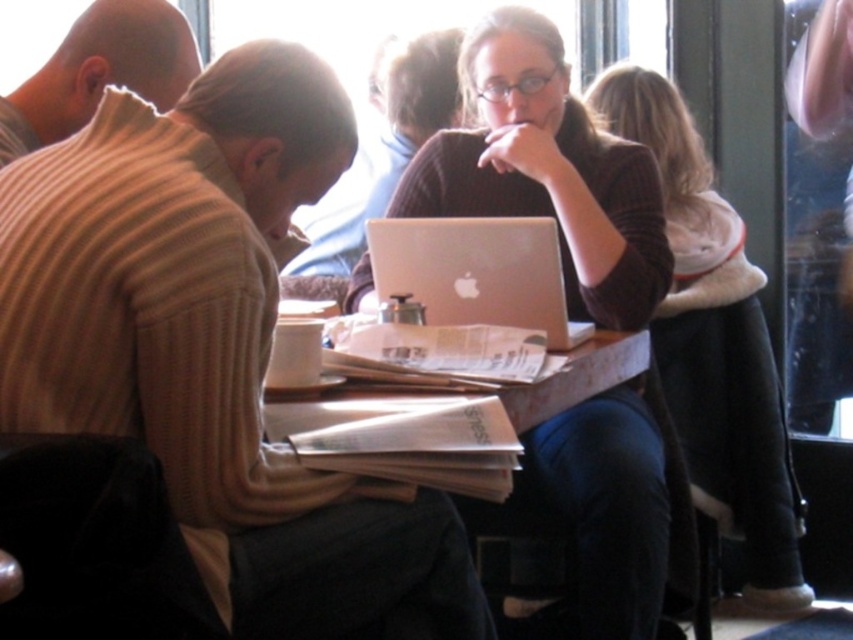
Question: Which point is farther from the camera taking this photo?

Choices:
 (A) (277, 554)
 (B) (589, 540)

Answer: (B)

Question: Among these objects, which one is farthest from the camera?

Choices:
 (A) silver metallic laptop at center
 (B) white paper at center

Answer: (A)

Question: Where is beige ribbed sweater at center located in relation to silver metallic laptop at center in the image?

Choices:
 (A) below
 (B) above

Answer: (A)

Question: Does beige ribbed sweater at center come behind white paper at center?

Choices:
 (A) no
 (B) yes

Answer: (A)

Question: Does beige ribbed sweater at center lie behind white paper at center?

Choices:
 (A) yes
 (B) no

Answer: (B)

Question: Among these objects, which one is nearest to the camera?

Choices:
 (A) silver metallic laptop at center
 (B) white paper at center
 (C) beige ribbed sweater at center

Answer: (C)